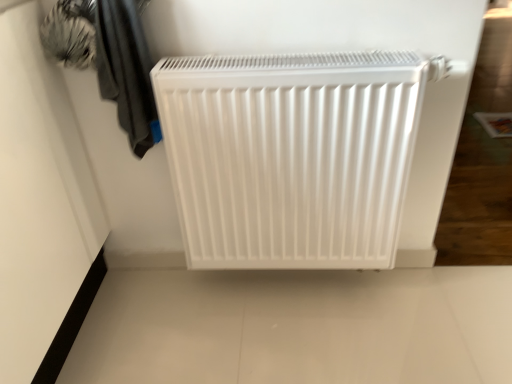
Question: Considering the positions of white matte radiator at center and dark gray fabric at upper left in the image, is white matte radiator at center bigger or smaller than dark gray fabric at upper left?

Choices:
 (A) small
 (B) big

Answer: (B)

Question: Is white matte radiator at center to the left or to the right of dark gray fabric at upper left in the image?

Choices:
 (A) left
 (B) right

Answer: (B)

Question: Considering the positions of point (216, 155) and point (151, 135), is point (216, 155) closer or farther from the camera than point (151, 135)?

Choices:
 (A) farther
 (B) closer

Answer: (B)

Question: Looking at their shapes, would you say dark gray fabric at upper left is wider or thinner than white matte radiator at center?

Choices:
 (A) thin
 (B) wide

Answer: (B)

Question: From a real-world perspective, is dark gray fabric at upper left physically located above or below white matte radiator at center?

Choices:
 (A) above
 (B) below

Answer: (A)

Question: From their relative heights in the image, would you say dark gray fabric at upper left is taller or shorter than white matte radiator at center?

Choices:
 (A) short
 (B) tall

Answer: (A)

Question: Is dark gray fabric at upper left in front of or behind white matte radiator at center in the image?

Choices:
 (A) front
 (B) behind

Answer: (A)